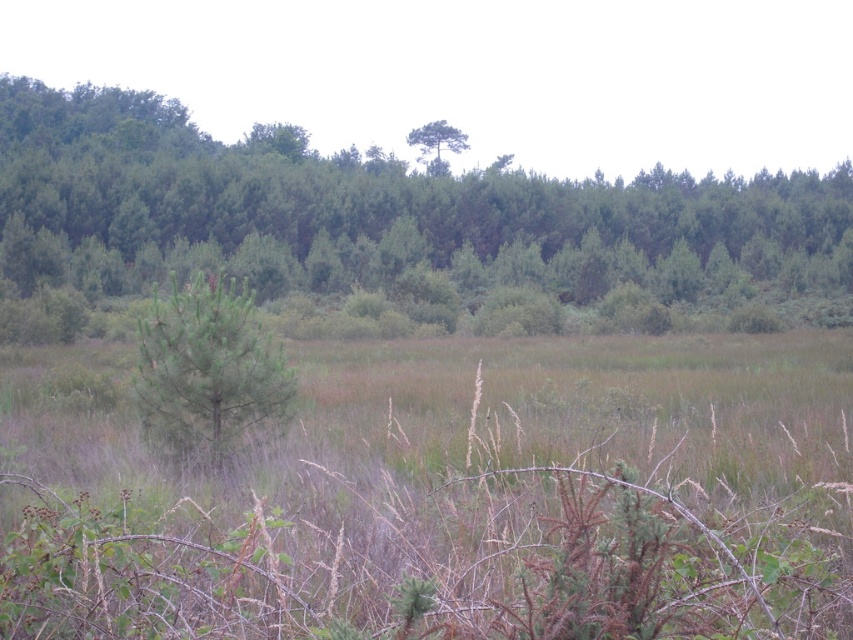
Can you confirm if green matte tree at center is bigger than green matte tree at upper center?

Actually, green matte tree at center might be smaller than green matte tree at upper center.

Image resolution: width=853 pixels, height=640 pixels. What do you see at coordinates (207, 365) in the screenshot? I see `green matte tree at center` at bounding box center [207, 365].

Locate an element on the screen. green matte tree at center is located at coordinates (207, 365).

Can you confirm if green leafy tree at center is positioned to the left of green matte tree at upper center?

Yes, green leafy tree at center is to the left of green matte tree at upper center.

Based on the photo, can you confirm if green leafy tree at center is wider than green matte tree at upper center?

Correct, the width of green leafy tree at center exceeds that of green matte tree at upper center.

I want to click on green leafy tree at center, so click(378, 211).

Image resolution: width=853 pixels, height=640 pixels. In order to click on green leafy tree at center in this screenshot , I will do tap(378, 211).

Who is positioned more to the left, green leafy tree at center or green matte tree at center?

From the viewer's perspective, green leafy tree at center appears more on the left side.

Who is more distant from viewer, (593, 180) or (231, 365)?

Positioned behind is point (593, 180).

Between point (550, 252) and point (241, 292), which one is positioned in front?

Point (241, 292) is more forward.

Image resolution: width=853 pixels, height=640 pixels. I want to click on green leafy tree at center, so click(378, 211).